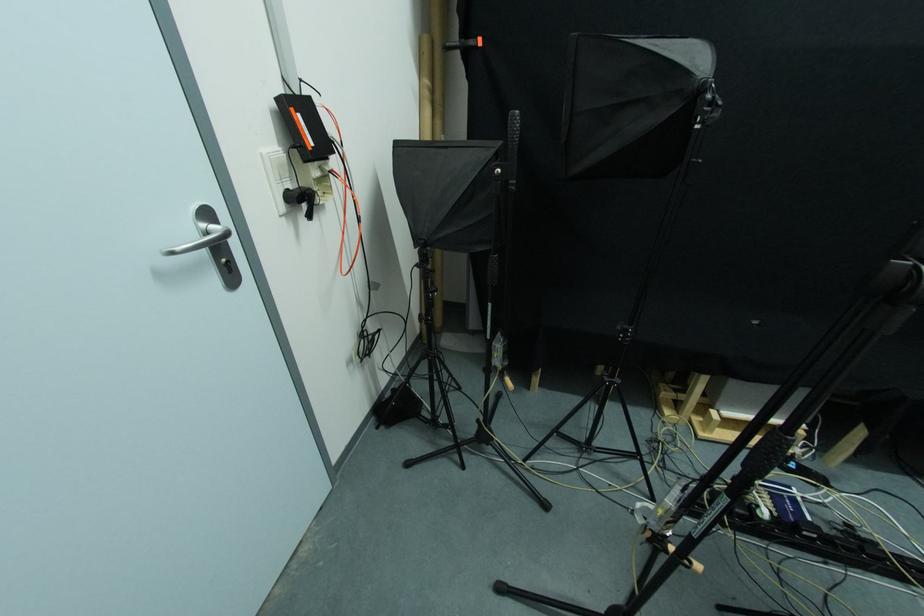
Image resolution: width=924 pixels, height=616 pixels. Describe the element at coordinates (201, 240) in the screenshot. I see `the silver door handle` at that location.